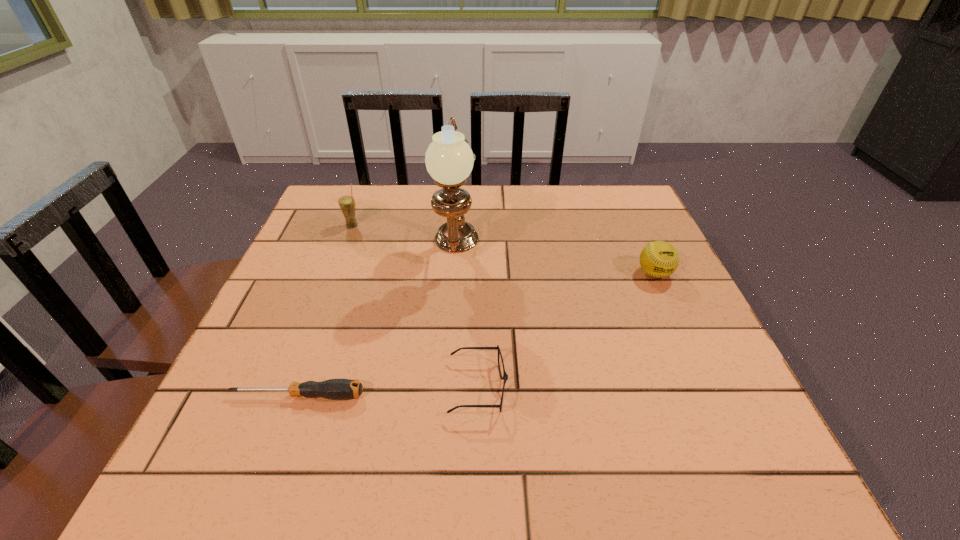
What are the coordinates of `vacant space at the right edge of the desktop` in the screenshot? It's located at (637, 343).

This screenshot has height=540, width=960. In order to click on free space at the near left corner of the desktop in this screenshot , I will do `click(269, 482)`.

The image size is (960, 540). In order to click on vacant area at the far right corner of the desktop in this screenshot , I will do point(590,192).

You are a GUI agent. You are given a task and a screenshot of the screen. Output one action in this format:
    pyautogui.click(x=<x>, y=<y>)
    Task: Click on the vacant space that's between the fourth shortest object and the shortest object
    The image size is (960, 540).
    Given the screenshot: What is the action you would take?
    pyautogui.click(x=325, y=310)

Image resolution: width=960 pixels, height=540 pixels. I want to click on free spot between the second tallest object and the tallest object, so click(x=404, y=240).

Identify the location of vacant region between the screwdriver and the spectacles. (388, 392).

Locate an element on the screen. free space between the straw for drinking and the shortest object is located at coordinates (325, 310).

Identify the location of empty location between the fourth shortest object and the shortest object. The image size is (960, 540). (325, 310).

The height and width of the screenshot is (540, 960). In order to click on free space between the screwdriver and the rightmost object in this screenshot , I will do `click(476, 334)`.

This screenshot has width=960, height=540. I want to click on free spot between the straw for drinking and the rightmost object, so click(503, 249).